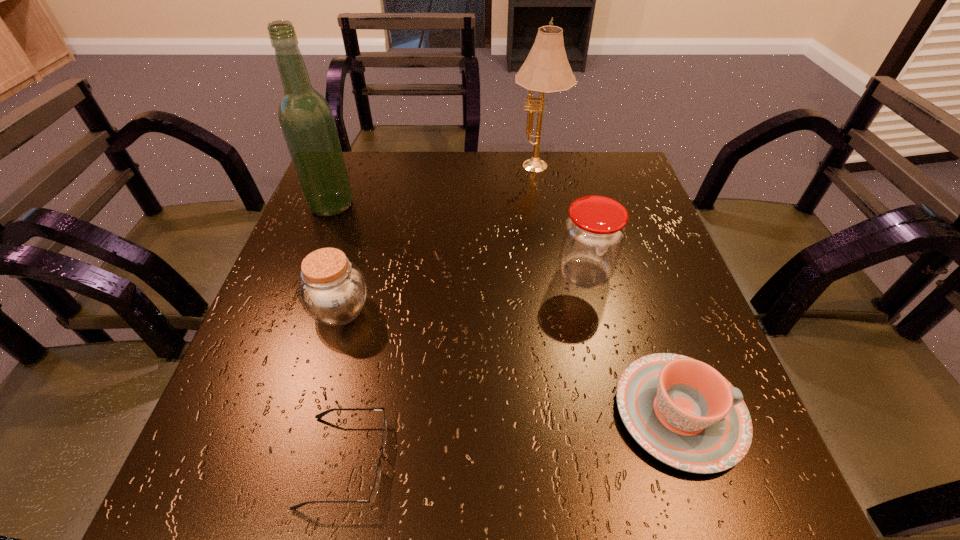
Identify the location of liquor. (306, 119).

Where is `lampshade`? Image resolution: width=960 pixels, height=540 pixels. lampshade is located at coordinates (546, 70).

You are a GUI agent. You are given a task and a screenshot of the screen. Output one action in this format:
    pyautogui.click(x=<x>, y=<y>)
    Task: Click on the right jar
    This screenshot has width=960, height=540.
    Given the screenshot: What is the action you would take?
    pyautogui.click(x=594, y=232)

Find the location of a particular element. This screenshot has height=540, width=960. the taller jar is located at coordinates (594, 232).

I want to click on the left jar, so click(x=333, y=291).

Identify the location of the third shortest object. Image resolution: width=960 pixels, height=540 pixels. (333, 291).

At what (x,y) coordinates should I click in order to perform the action: click on chinaware. Please return your answer as a coordinate pair (x, y). The image size is (960, 540). Looking at the image, I should click on (683, 412).

I want to click on the shortest object, so click(375, 488).

The image size is (960, 540). Identify the location of free space located 0.060m on the right of the liquor. (378, 205).

Where is `vacant space located 0.090m on the left of the farthest object`? Image resolution: width=960 pixels, height=540 pixels. vacant space located 0.090m on the left of the farthest object is located at coordinates (477, 168).